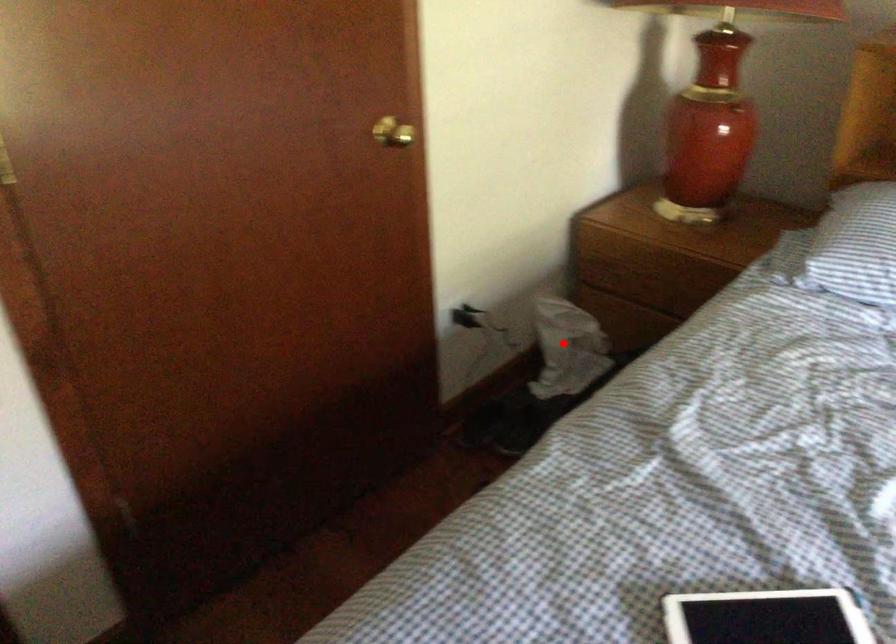
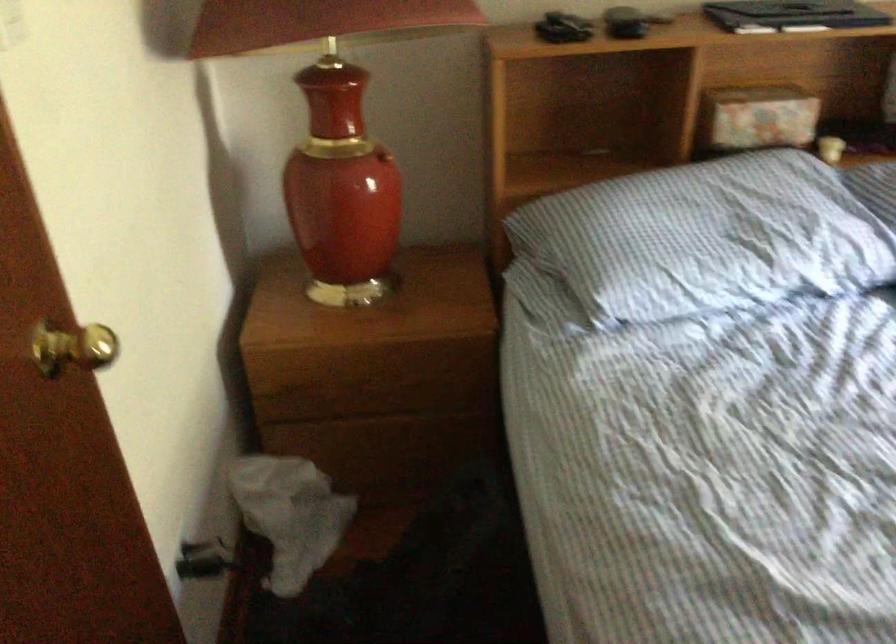
Question: A red point is marked in image1. In image2, is the corresponding 3D point closer to the camera or farther? Reply with the corresponding letter.

Choices:
 (A) The corresponding 3D point is closer.
 (B) The corresponding 3D point is farther.

Answer: (A)